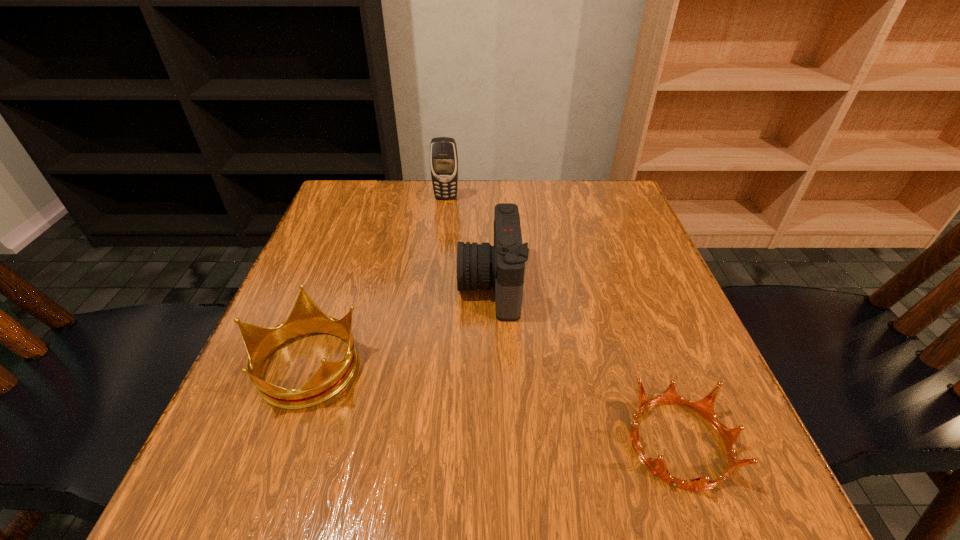
Identify the location of vacant area that lies between the camera and the right crown. This screenshot has width=960, height=540. (585, 363).

I want to click on empty space that is in between the farthest object and the taller crown, so point(376,281).

Locate an element on the screen. free space that is in between the leftmost object and the cellular telephone is located at coordinates (376, 281).

You are a GUI agent. You are given a task and a screenshot of the screen. Output one action in this format:
    pyautogui.click(x=<x>, y=<y>)
    Task: Click on the free spot between the farthest object and the leftmost object
    The image size is (960, 540).
    Given the screenshot: What is the action you would take?
    pyautogui.click(x=376, y=281)

In order to click on vacant area that lies between the shorter crown and the second object from right to left in this screenshot , I will do `click(585, 363)`.

In order to click on object that is the second closest one to the second object from left to right in this screenshot , I will do `click(306, 317)`.

Find the location of a particular element. This screenshot has height=540, width=960. object that can be found as the second closest to the left crown is located at coordinates (705, 407).

Find the location of a particular element. blank space that satisfies the following two spatial constraints: 1. at the lens of the second tallest object; 2. on the back side of the shorter crown is located at coordinates (494, 443).

Where is `free space that satisfies the following two spatial constraints: 1. at the lens of the right crown; 2. on the left side of the second tallest object`? free space that satisfies the following two spatial constraints: 1. at the lens of the right crown; 2. on the left side of the second tallest object is located at coordinates (494, 443).

Find the location of `vacant region that satisfies the following two spatial constraints: 1. on the front side of the shorter crown; 2. on the left side of the left crown`. vacant region that satisfies the following two spatial constraints: 1. on the front side of the shorter crown; 2. on the left side of the left crown is located at coordinates (277, 443).